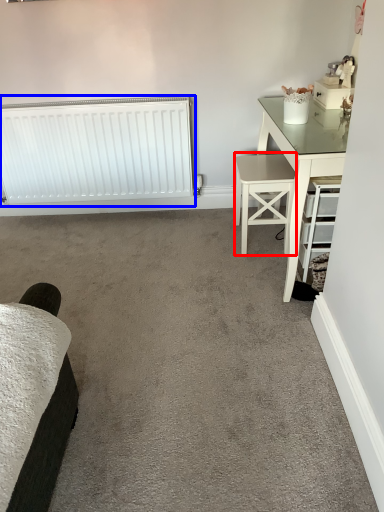
Question: Which of the following is the closest to the observer, stool (highlighted by a red box) or radiator (highlighted by a blue box)?

Choices:
 (A) stool
 (B) radiator

Answer: (A)